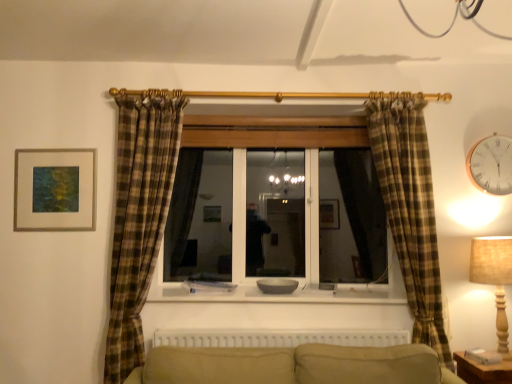
Question: From a real-world perspective, is gold metallic clock at upper right positioned above or below beige fabric lampshade at right?

Choices:
 (A) below
 (B) above

Answer: (B)

Question: Considering the positions of gold metallic clock at upper right and beige fabric lampshade at right in the image, is gold metallic clock at upper right wider or thinner than beige fabric lampshade at right?

Choices:
 (A) wide
 (B) thin

Answer: (B)

Question: Considering the real-world distances, which object is closest to the gold metallic clock at upper right?

Choices:
 (A) white plastic radiator at lower center
 (B) matte gold picture frame at upper left
 (C) beige fabric lampshade at right
 (D) smooth white window sill at center

Answer: (C)

Question: Which is nearer to the gold metallic clock at upper right?

Choices:
 (A) smooth white window sill at center
 (B) matte gold picture frame at upper left
 (C) beige fabric lampshade at right
 (D) white plastic radiator at lower center

Answer: (C)